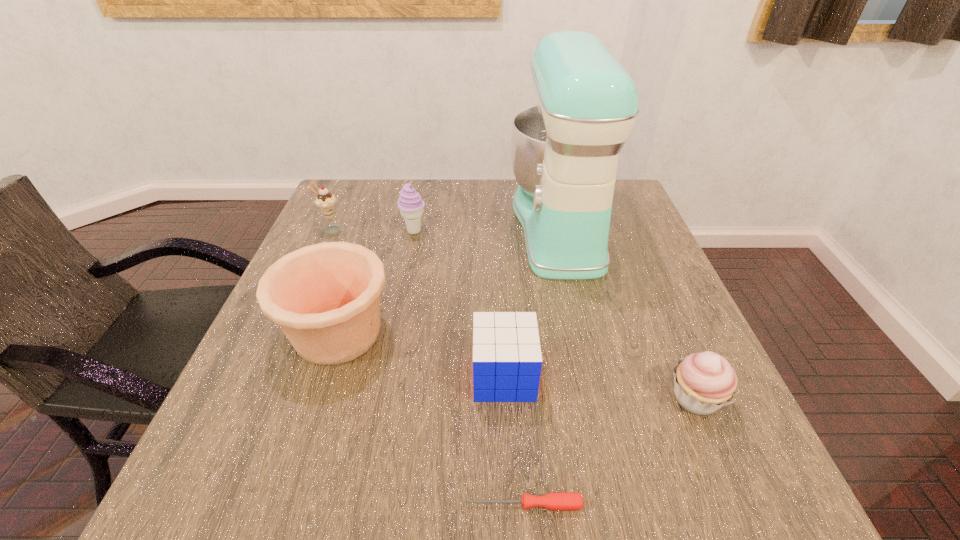
Locate an element on the screen. The height and width of the screenshot is (540, 960). mixer is located at coordinates (564, 152).

Where is `the left icecream`? the left icecream is located at coordinates click(326, 202).

Find the location of a particular element. This screenshot has height=540, width=960. pottery is located at coordinates pos(325,297).

At what (x,y) coordinates should I click in order to perform the action: click on the right icecream. Please return your answer as a coordinate pair (x, y). The width and height of the screenshot is (960, 540). Looking at the image, I should click on (410, 204).

This screenshot has height=540, width=960. I want to click on cupcake, so click(703, 382).

Where is `cube`? The height and width of the screenshot is (540, 960). cube is located at coordinates pyautogui.click(x=507, y=361).

You are a GUI agent. You are given a task and a screenshot of the screen. Output one action in this format:
    pyautogui.click(x=<x>, y=<y>)
    Task: Click on the nearest object
    
    Given the screenshot: What is the action you would take?
    pyautogui.click(x=558, y=501)

Locate an element on the screen. This screenshot has height=540, width=960. screwdriver is located at coordinates (558, 501).

Where is `vacant space located 0.380m at the base of the mixer`? The width and height of the screenshot is (960, 540). vacant space located 0.380m at the base of the mixer is located at coordinates (369, 226).

Where is `vacant space positioned at the base of the mixer`? The width and height of the screenshot is (960, 540). vacant space positioned at the base of the mixer is located at coordinates (443, 226).